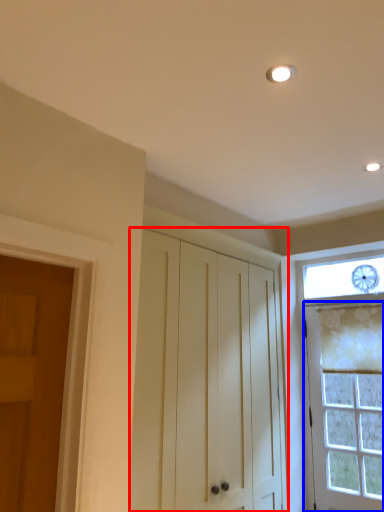
Question: Which of the following is the closest to the observer, cabinetry (highlighted by a red box) or door (highlighted by a blue box)?

Choices:
 (A) cabinetry
 (B) door

Answer: (A)